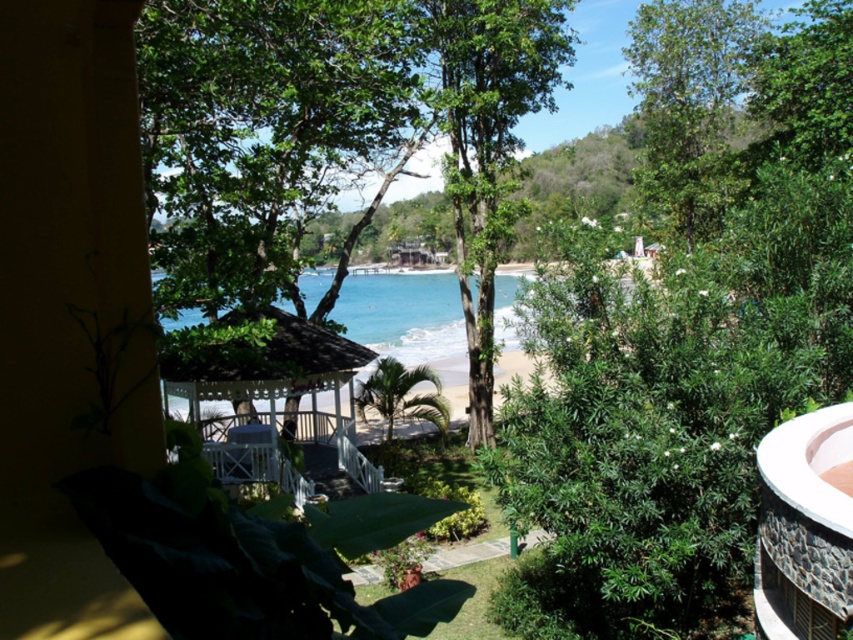
You are standing on the balcony looking at the coastal scene. There are two points marked in the image. One is at coordinate point(685, 104) and the other is at point(349, 426). Which point is closer to your current position?

Point(685, 104) is further to the camera than point(349, 426), so the point closer to your position is point(349, 426).

You are a landscape architect designing a walking path between the green leafy tree at upper right and the white wooden gazebo at center. What is the minimum length the path must be to connect these two points?

The minimum length the path must be to connect the green leafy tree at upper right and the white wooden gazebo at center is 18.16 meters, as that is the distance between them.